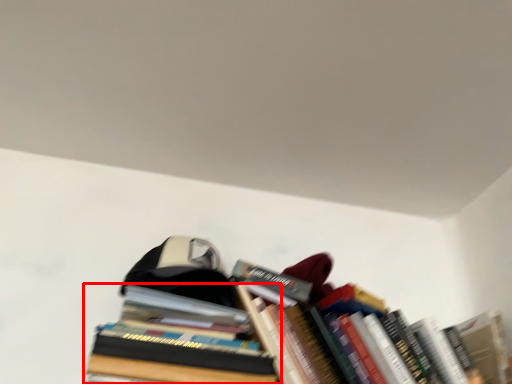
Question: From the image's perspective, what is the correct spatial positioning of book (annotated by the red box) in reference to book?

Choices:
 (A) below
 (B) above

Answer: (B)